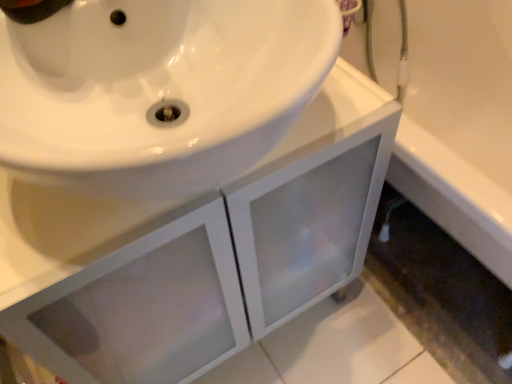
Question: Considering the relative sizes of white frosted glass cabinet at center and white glossy bathtub at lower right in the image provided, is white frosted glass cabinet at center bigger than white glossy bathtub at lower right?

Choices:
 (A) yes
 (B) no

Answer: (A)

Question: Considering the relative positions of white frosted glass cabinet at center and white glossy bathtub at lower right in the image provided, is white frosted glass cabinet at center to the right of white glossy bathtub at lower right from the viewer's perspective?

Choices:
 (A) yes
 (B) no

Answer: (B)

Question: Is white frosted glass cabinet at center closer to camera compared to white glossy bathtub at lower right?

Choices:
 (A) no
 (B) yes

Answer: (B)

Question: Is white frosted glass cabinet at center positioned behind white glossy bathtub at lower right?

Choices:
 (A) no
 (B) yes

Answer: (A)

Question: Is white frosted glass cabinet at center looking in the opposite direction of white glossy bathtub at lower right?

Choices:
 (A) no
 (B) yes

Answer: (A)

Question: Considering the relative sizes of white frosted glass cabinet at center and white glossy bathtub at lower right in the image provided, is white frosted glass cabinet at center wider than white glossy bathtub at lower right?

Choices:
 (A) yes
 (B) no

Answer: (B)

Question: Does white glossy bathtub at lower right appear on the right side of white frosted glass cabinet at center?

Choices:
 (A) yes
 (B) no

Answer: (A)

Question: From the image's perspective, is white glossy bathtub at lower right beneath white frosted glass cabinet at center?

Choices:
 (A) no
 (B) yes

Answer: (A)

Question: Can you confirm if white glossy bathtub at lower right is smaller than white frosted glass cabinet at center?

Choices:
 (A) yes
 (B) no

Answer: (A)

Question: Is white glossy bathtub at lower right behind white frosted glass cabinet at center?

Choices:
 (A) no
 (B) yes

Answer: (B)

Question: Can you confirm if white glossy bathtub at lower right is taller than white frosted glass cabinet at center?

Choices:
 (A) yes
 (B) no

Answer: (B)

Question: Can you confirm if white glossy bathtub at lower right is shorter than white frosted glass cabinet at center?

Choices:
 (A) yes
 (B) no

Answer: (A)

Question: Considering the positions of white glossy bathtub at lower right and white frosted glass cabinet at center in the image, is white glossy bathtub at lower right taller or shorter than white frosted glass cabinet at center?

Choices:
 (A) tall
 (B) short

Answer: (B)